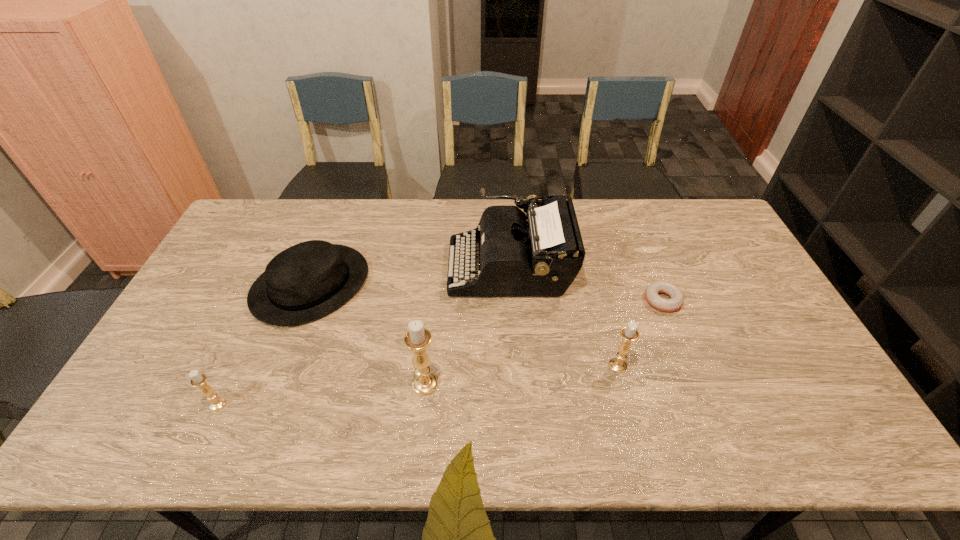
The width and height of the screenshot is (960, 540). In the image, there is a desktop. What are the coordinates of `free space at the near edge` in the screenshot? It's located at coord(252,391).

The image size is (960, 540). I want to click on vacant space at the left edge, so click(x=251, y=258).

Where is `free point at the right edge`? The width and height of the screenshot is (960, 540). free point at the right edge is located at coordinates (750, 353).

In the image, there is a desktop. Identify the location of vacant space at the far left corner. The image size is (960, 540). [x=269, y=221].

I want to click on vacant region at the near left corner of the desktop, so click(160, 384).

Locate an element on the screen. The width and height of the screenshot is (960, 540). free spot between the fifth object from left to right and the fedora is located at coordinates [x=465, y=325].

Where is `free space between the nearest object and the second shortest object`? The height and width of the screenshot is (540, 960). free space between the nearest object and the second shortest object is located at coordinates (264, 345).

Locate an element on the screen. This screenshot has height=540, width=960. blank region between the doughnut and the fourth object from left to right is located at coordinates (587, 284).

This screenshot has width=960, height=540. What are the coordinates of `free area in between the rightmost object and the nearest candle holder` in the screenshot? It's located at (440, 352).

You are a GUI agent. You are given a task and a screenshot of the screen. Output one action in this format:
    pyautogui.click(x=<x>, y=<y>)
    Task: Click on the unoccupied position between the nearest candle holder and the shortest object
    The width and height of the screenshot is (960, 540).
    Given the screenshot: What is the action you would take?
    pyautogui.click(x=440, y=352)